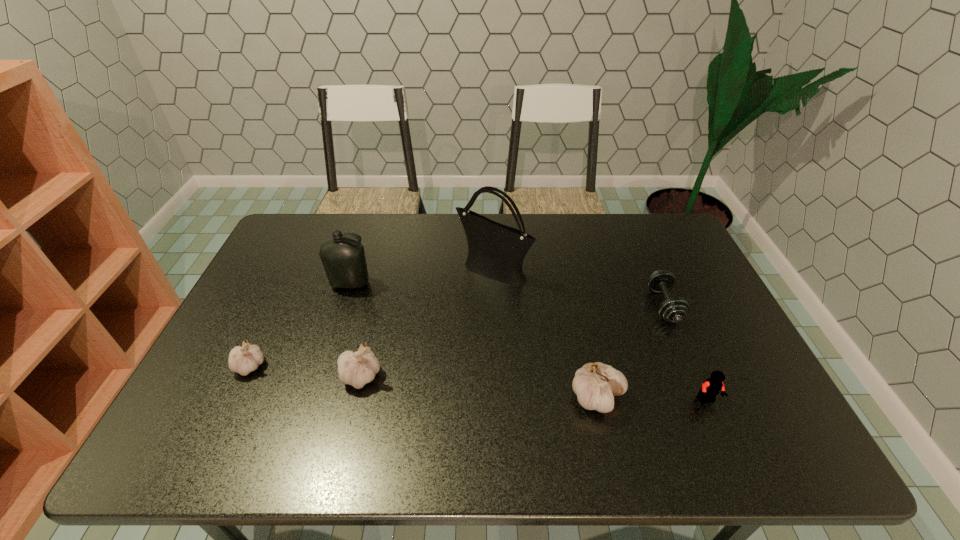
Identify the location of Lego at the right edge. (712, 386).

I want to click on dumbbell that is at the right edge, so click(x=674, y=310).

Identify the location of object present at the near right corner. (712, 386).

This screenshot has width=960, height=540. In the image, there is a desktop. Identify the location of vacant region at the far edge. (564, 221).

This screenshot has height=540, width=960. Find the location of `vacant position at the near edge of the desktop`. vacant position at the near edge of the desktop is located at coordinates (387, 415).

Where is `free spot at the left edge of the desktop`? The image size is (960, 540). free spot at the left edge of the desktop is located at coordinates pyautogui.click(x=276, y=268).

Locate an element on the screen. The width and height of the screenshot is (960, 540). vacant space at the right edge is located at coordinates (711, 294).

The image size is (960, 540). What are the coordinates of `vacant space at the far left corner of the desktop` in the screenshot? It's located at (330, 227).

You are a GUI agent. You are given a task and a screenshot of the screen. Output one action in this format:
    pyautogui.click(x=<x>, y=<y>)
    Task: Click on the vacant space at the near right corner of the desktop
    Image resolution: width=960 pixels, height=540 pixels.
    Given the screenshot: What is the action you would take?
    pyautogui.click(x=780, y=412)

Locate an element on the screen. This screenshot has width=960, height=540. free space between the third object from right to left and the fourth shortest object is located at coordinates (479, 387).